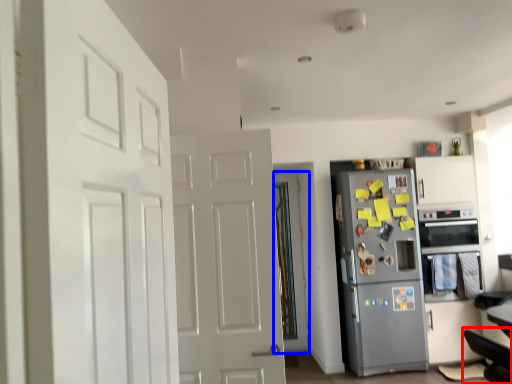
Question: Which of the following is the farthest to the observer, swivel chair (highlighted by a red box) or door (highlighted by a blue box)?

Choices:
 (A) swivel chair
 (B) door

Answer: (B)